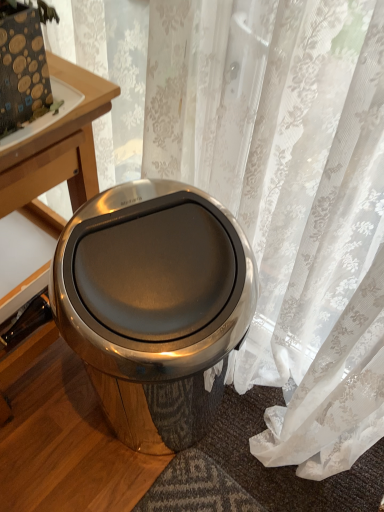
What do you see at coordinates (154, 306) in the screenshot? The height and width of the screenshot is (512, 384). I see `polished stainless steel trash can at center` at bounding box center [154, 306].

What do you see at coordinates (291, 198) in the screenshot? The image size is (384, 512). I see `translucent floral curtain at center` at bounding box center [291, 198].

This screenshot has width=384, height=512. In order to click on polished stainless steel trash can at center in this screenshot , I will do `click(154, 306)`.

From a real-world perspective, which is physically below, translucent floral curtain at center or wooden table at upper left?

From a 3D spatial view, translucent floral curtain at center is below.

How different are the orientations of translucent floral curtain at center and wooden table at upper left in degrees?

The angle between the facing direction of translucent floral curtain at center and the facing direction of wooden table at upper left is 2.62 degrees.

Is point (318, 152) positioned behind point (63, 141)?

No, it is in front of (63, 141).

Is translucent floral curtain at center not close to wooden table at upper left?

No, there isn't a large distance between translucent floral curtain at center and wooden table at upper left.

Is translucent floral curtain at center placed right next to wooden table at left?

No.

This screenshot has width=384, height=512. Identify the location of table lying on the left of translucent floral curtain at center. (57, 152).

Is translucent floral curtain at center located outside wooden table at left?

translucent floral curtain at center lies outside wooden table at left's area.

Considering the relative sizes of wooden table at left and wooden table at upper left in the image provided, is wooden table at left wider than wooden table at upper left?

Indeed, wooden table at left has a greater width compared to wooden table at upper left.

Is wooden table at left at the right side of wooden table at upper left?

In fact, wooden table at left is to the left of wooden table at upper left.

Is wooden table at left directly adjacent to wooden table at upper left?

Yes, wooden table at left is with wooden table at upper left.

Is wooden table at left oriented towards wooden table at upper left?

No, wooden table at left is not aimed at wooden table at upper left.

From the picture: Which is closer, (177, 362) or (85, 130)?

Point (177, 362).

Is polished stainless steel trash can at center surrounding wooden table at upper left?

No, wooden table at upper left is located outside of polished stainless steel trash can at center.

Looking at this image, is the surface of polished stainless steel trash can at center in direct contact with wooden table at upper left?

They are not placed beside each other.

How different are the orientations of polished stainless steel trash can at center and wooden table at left in degrees?

polished stainless steel trash can at center and wooden table at left are facing 7.34 degrees away from each other.

Does point (72, 234) appear closer or farther from the camera than point (52, 227)?

Point (72, 234).

Is polished stainless steel trash can at center facing towards wooden table at left?

No, polished stainless steel trash can at center is not turned towards wooden table at left.

Considering the relative positions of polished stainless steel trash can at center and wooden table at left in the image provided, is polished stainless steel trash can at center to the right of wooden table at left from the viewer's perspective?

Correct, you'll find polished stainless steel trash can at center to the right of wooden table at left.

Could you tell me if wooden table at upper left is facing polished stainless steel trash can at center?

No, wooden table at upper left is not aimed at polished stainless steel trash can at center.

In the scene shown: Is wooden table at upper left thinner than polished stainless steel trash can at center?

Correct, the width of wooden table at upper left is less than that of polished stainless steel trash can at center.

What's the angular difference between wooden table at upper left and polished stainless steel trash can at center's facing directions?

The angle between the facing direction of wooden table at upper left and the facing direction of polished stainless steel trash can at center is 2.25 degrees.

Are wooden table at upper left and translucent floral curtain at center located far from each other?

That's not correct — wooden table at upper left is a little close to translucent floral curtain at center.

Which object is closer to the camera taking this photo, wooden table at upper left or translucent floral curtain at center?

Positioned in front is translucent floral curtain at center.

How many degrees apart are the facing directions of wooden table at upper left and translucent floral curtain at center?

The angular difference between wooden table at upper left and translucent floral curtain at center is 2.62 degrees.

Considering the relative positions of wooden table at upper left and translucent floral curtain at center in the image provided, is wooden table at upper left to the right of translucent floral curtain at center from the viewer's perspective?

No, wooden table at upper left is not to the right of translucent floral curtain at center.

The height and width of the screenshot is (512, 384). In order to click on curtain lying in front of the wooden table at upper left in this screenshot , I will do `click(291, 198)`.

Locate an element on the screen. The image size is (384, 512). table behind the translucent floral curtain at center is located at coordinates (57, 152).

Based on their spatial positions, is wooden table at upper left or wooden table at left closer to translucent floral curtain at center?

wooden table at upper left.

Looking at the image, which one is located further to translucent floral curtain at center, polished stainless steel trash can at center or wooden table at left?

Among the two, wooden table at left is located further to translucent floral curtain at center.

Considering their positions, is translucent floral curtain at center positioned further to wooden table at upper left than wooden table at left?

translucent floral curtain at center lies further to wooden table at upper left than the other object.

When comparing their distances from polished stainless steel trash can at center, does wooden table at left or translucent floral curtain at center seem further?

wooden table at left is further to polished stainless steel trash can at center.

From the image, which object appears to be farther from wooden table at upper left, wooden table at left or polished stainless steel trash can at center?

The object further to wooden table at upper left is polished stainless steel trash can at center.

Considering their positions, is polished stainless steel trash can at center positioned closer to translucent floral curtain at center than wooden table at upper left?

polished stainless steel trash can at center is positioned closer to the anchor translucent floral curtain at center.

Estimate the real-world distances between objects in this image. Which object is closer to polished stainless steel trash can at center, translucent floral curtain at center or wooden table at left?

translucent floral curtain at center.

Which object lies further to the anchor point polished stainless steel trash can at center, wooden table at left or wooden table at upper left?

The object further to polished stainless steel trash can at center is wooden table at left.

Where is `toilet between wooden table at left and translucent floral curtain at center`? This screenshot has height=512, width=384. toilet between wooden table at left and translucent floral curtain at center is located at coordinates (154, 306).

You are a GUI agent. You are given a task and a screenshot of the screen. Output one action in this format:
    pyautogui.click(x=<x>, y=<y>)
    Task: Click on the round table between wooden table at left and polished stainless steel trash can at center
    This screenshot has width=384, height=512.
    Given the screenshot: What is the action you would take?
    pyautogui.click(x=58, y=146)

This screenshot has height=512, width=384. Find the location of `round table between wooden table at left and translucent floral curtain at center`. round table between wooden table at left and translucent floral curtain at center is located at coordinates (58, 146).

This screenshot has width=384, height=512. I want to click on curtain between wooden table at upper left and polished stainless steel trash can at center vertically, so click(x=291, y=198).